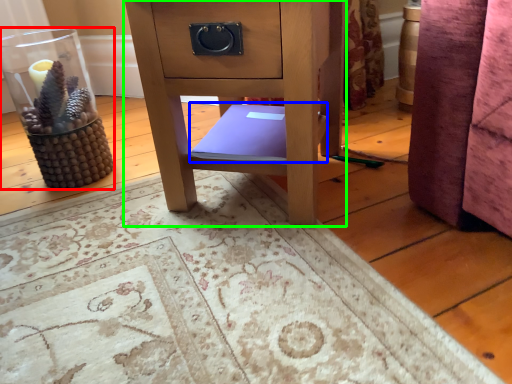
Question: Considering the real-world distances, which object is farthest from glass vase (highlighted by a red box)? book (highlighted by a blue box) or furniture (highlighted by a green box)?

Choices:
 (A) book
 (B) furniture

Answer: (B)